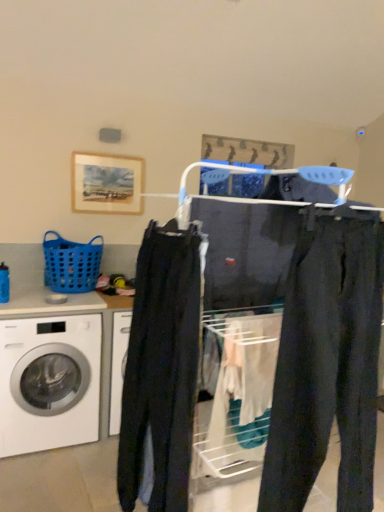
Question: From the image's perspective, is dark blue jeans at center under dark blue jeans at center?

Choices:
 (A) yes
 (B) no

Answer: (B)

Question: Does dark blue jeans at center lie in front of dark blue jeans at center?

Choices:
 (A) yes
 (B) no

Answer: (B)

Question: Can we say dark blue jeans at center lies outside dark blue jeans at center?

Choices:
 (A) yes
 (B) no

Answer: (B)

Question: Is dark blue jeans at center taller than dark blue jeans at center?

Choices:
 (A) yes
 (B) no

Answer: (B)

Question: Is dark blue jeans at center placed right next to dark blue jeans at center?

Choices:
 (A) yes
 (B) no

Answer: (B)

Question: Considering the relative sizes of dark blue jeans at center and dark blue jeans at center in the image provided, is dark blue jeans at center bigger than dark blue jeans at center?

Choices:
 (A) no
 (B) yes

Answer: (A)

Question: Considering the relative sizes of dark blue jeans at center and dark gray cotton pants at center in the image provided, is dark blue jeans at center wider than dark gray cotton pants at center?

Choices:
 (A) no
 (B) yes

Answer: (B)

Question: Would you say dark blue jeans at center is outside dark gray cotton pants at center?

Choices:
 (A) yes
 (B) no

Answer: (A)

Question: From a real-world perspective, is dark blue jeans at center beneath dark gray cotton pants at center?

Choices:
 (A) no
 (B) yes

Answer: (B)

Question: Is dark blue jeans at center smaller than dark gray cotton pants at center?

Choices:
 (A) no
 (B) yes

Answer: (A)

Question: Considering the relative sizes of dark blue jeans at center and dark gray cotton pants at center in the image provided, is dark blue jeans at center taller than dark gray cotton pants at center?

Choices:
 (A) yes
 (B) no

Answer: (A)

Question: From the image's perspective, is dark blue jeans at center beneath dark gray cotton pants at center?

Choices:
 (A) no
 (B) yes

Answer: (B)

Question: From a real-world perspective, is blue plastic basket at left beneath dark blue jeans at center?

Choices:
 (A) no
 (B) yes

Answer: (A)